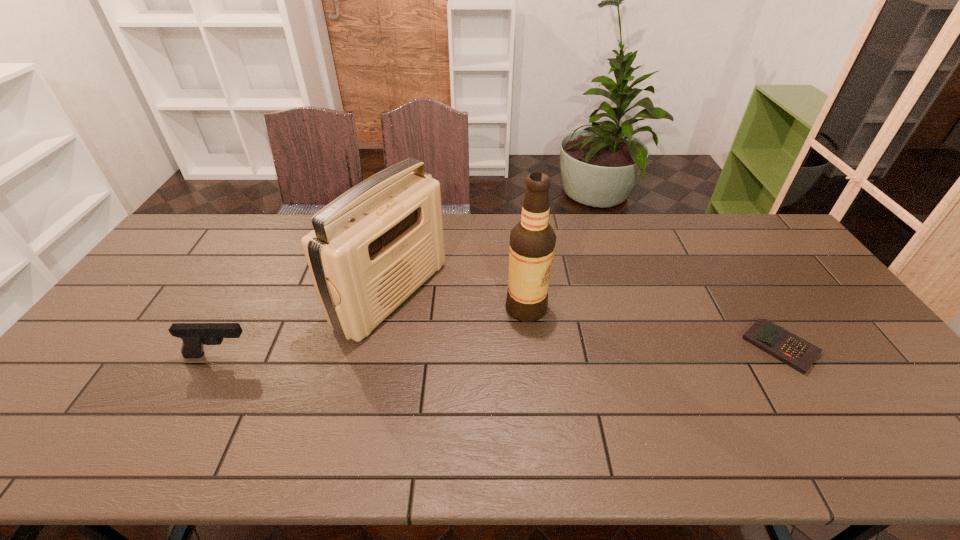
Locate an element on the screen. Image resolution: width=960 pixels, height=540 pixels. the leftmost object is located at coordinates (194, 336).

In order to click on pistol in this screenshot , I will do `click(194, 336)`.

Identify the location of the rightmost object. Image resolution: width=960 pixels, height=540 pixels. (799, 354).

You are a GUI agent. You are given a task and a screenshot of the screen. Output one action in this format:
    pyautogui.click(x=<x>, y=<y>)
    Task: Click on the calculator
    This screenshot has height=540, width=960.
    Given the screenshot: What is the action you would take?
    pyautogui.click(x=799, y=354)

Where is `radio receiver`? This screenshot has width=960, height=540. radio receiver is located at coordinates (372, 247).

Where is `the third object from left to right`? This screenshot has width=960, height=540. the third object from left to right is located at coordinates (532, 241).

Identify the location of free space located 0.160m on the front-facing side of the leftmost object. (315, 355).

This screenshot has width=960, height=540. Identify the location of free space located on the left of the calculator. (671, 347).

Find the location of `free space located on the front-facing side of the radio receiver`. free space located on the front-facing side of the radio receiver is located at coordinates (537, 372).

This screenshot has height=540, width=960. Identify the location of vacant position located on the front-facing side of the radio receiver. (449, 329).